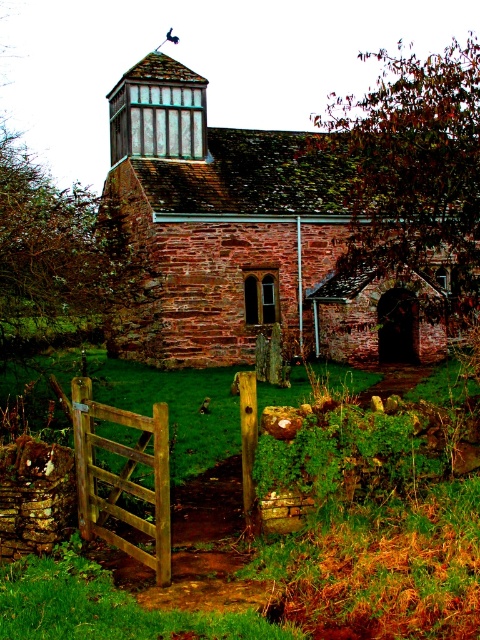
Consider the image. You are standing in front of the rustic stone building and notice a point marked at coordinates (410, 193). What object is located at that position?

The point at coordinates (410, 193) corresponds to the brown leafy tree at upper right.

From the picture: You are standing at the wooden gate at lower left and want to enter the brown brick church at center. Which direction should you walk to reach the church?

The brown brick church at center is located above the wooden gate at lower left, so you should walk upwards or towards the higher elevation to reach it.